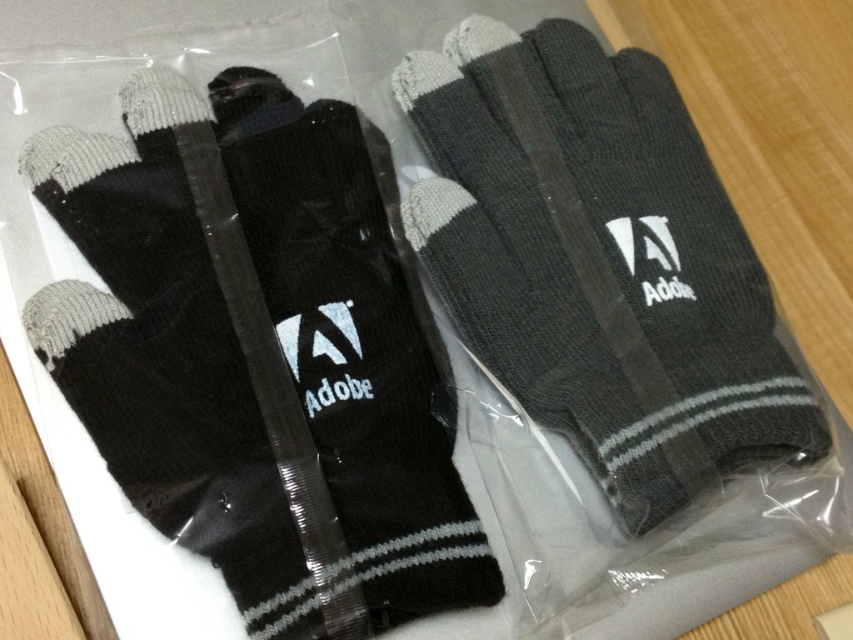
The width and height of the screenshot is (853, 640). In order to click on black knitted gloves at center in this screenshot , I will do `click(258, 355)`.

Does black knitted gloves at center appear on the left side of dark gray knitted glove at center?

Indeed, black knitted gloves at center is positioned on the left side of dark gray knitted glove at center.

Where is `black knitted gloves at center`? The height and width of the screenshot is (640, 853). black knitted gloves at center is located at coordinates (258, 355).